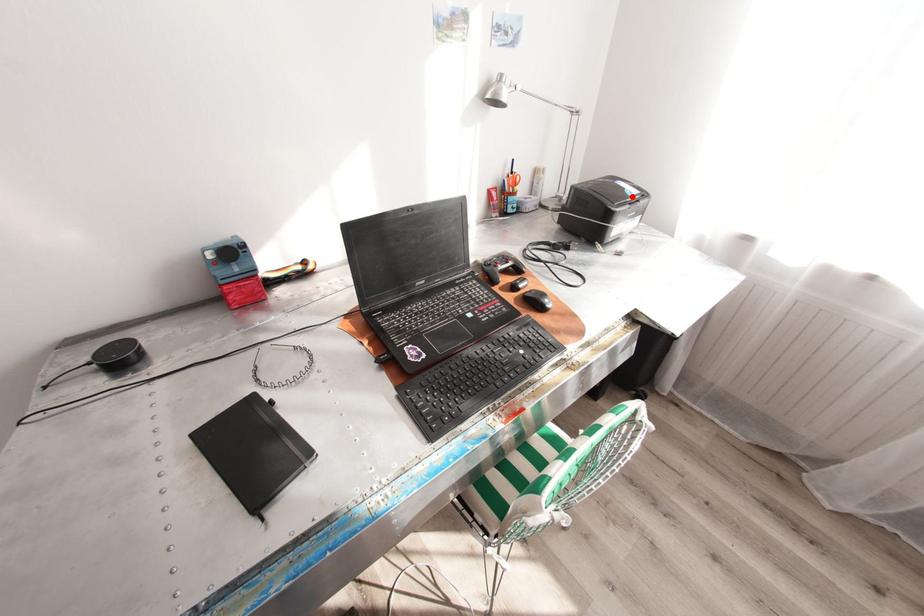
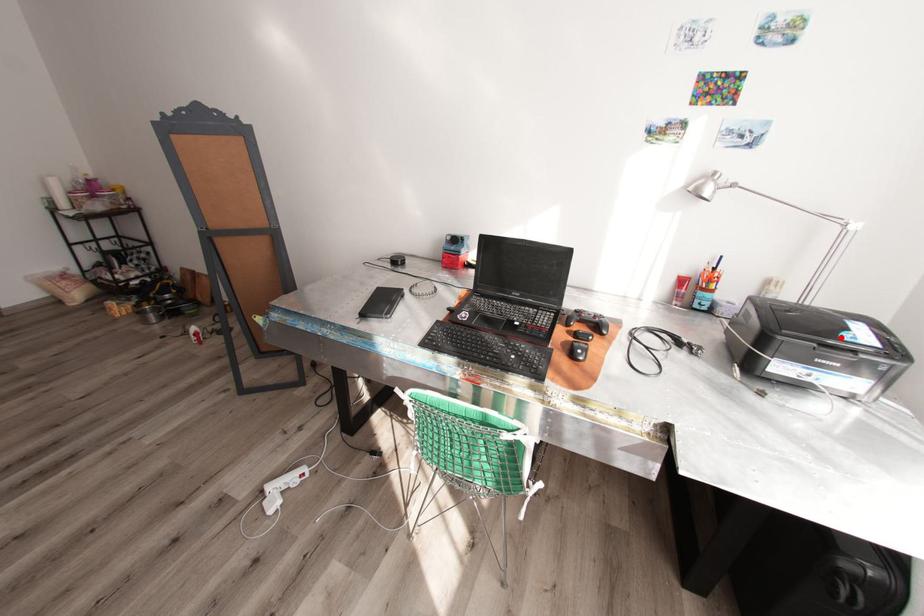
I am providing you with two images of the same scene from different viewpoints. A red point is marked on the first image and another point is marked on the second image. Do the highlighted points in image1 and image2 indicate the same real-world spot?

Yes